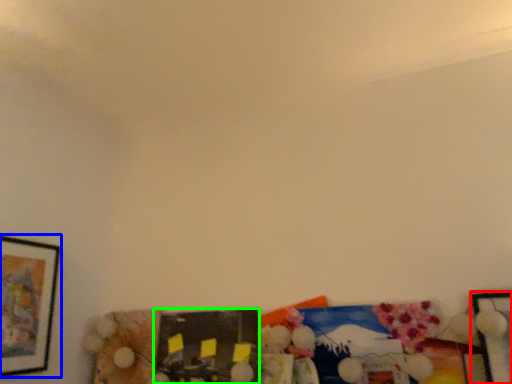
Question: Considering the real-world distances, which object is farthest from picture frame (highlighted by a red box)? picture frame (highlighted by a blue box) or picture frame (highlighted by a green box)?

Choices:
 (A) picture frame
 (B) picture frame

Answer: (A)